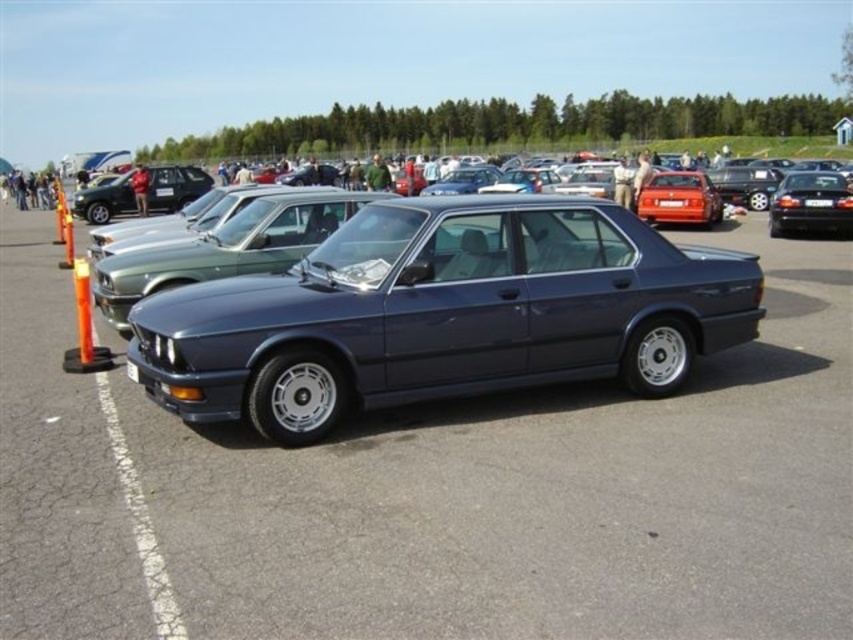
What are the coordinates of the satin dark blue sedan at center?

The satin dark blue sedan at center is located at coordinates point (444, 314).

You are at a car show and want to park your car between the metallic silver sedan at center and the orange plastic cone at left. Can you fit your car there?

The metallic silver sedan at center is to the left of the orange plastic cone at left, so there is space between them for your car to park.

You are standing at the car show and want to take a photo of the point at coordinates (614, 250). If your camera has a focal length of 50mm and you want to ensure the point is in focus, what is the minimum distance you need to be from the point to capture it clearly?

The point at coordinates (614, 250) is 5.64 meters from the viewer. To ensure it is in focus, you need to be at least 5.64 meters away from the point.